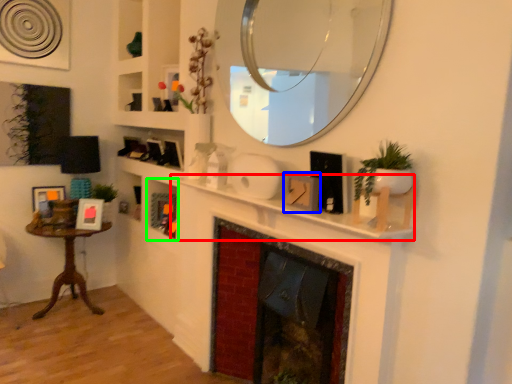
Question: Considering the real-world distances, which object is farthest from mantle (highlighted by a red box)? picture frame (highlighted by a blue box) or cabinet (highlighted by a green box)?

Choices:
 (A) picture frame
 (B) cabinet

Answer: (B)